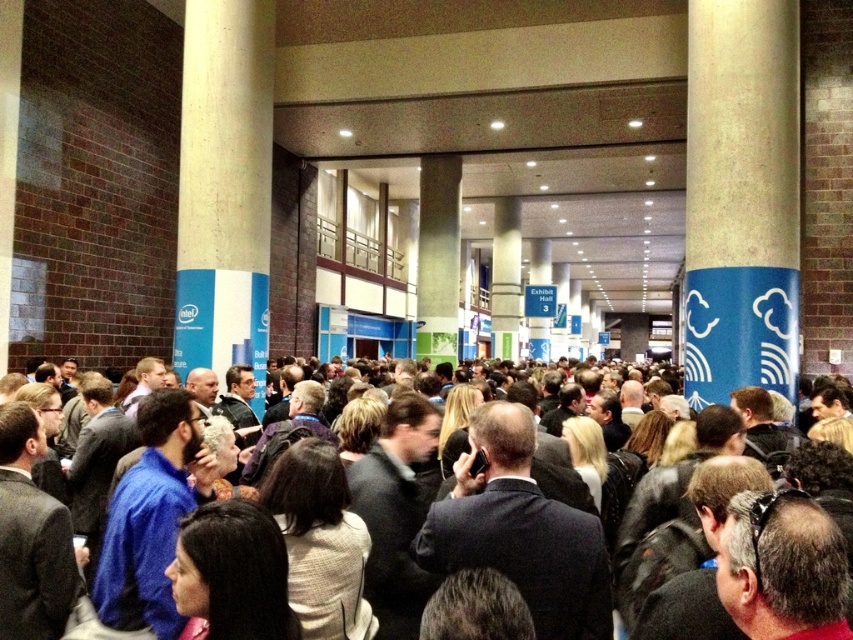
Who is lower down, blue textured pillar at right or dark suit at center?

dark suit at center is below.

In the scene shown: Which is more to the right, blue textured pillar at right or dark suit at center?

From the viewer's perspective, blue textured pillar at right appears more on the right side.

Is point (714, 342) closer to camera compared to point (821, 468)?

No, (714, 342) is behind (821, 468).

Where is `blue textured pillar at right`? The image size is (853, 640). blue textured pillar at right is located at coordinates (741, 196).

Locate an element on the screen. dark suit at center is located at coordinates (657, 531).

Which is behind, point (792, 458) or point (224, 228)?

The point (224, 228) is more distant.

Find the location of a particular element. dark suit at center is located at coordinates (657, 531).

Between blue textured pillar at right and smooth concrete pillar at left, which one is positioned lower?

smooth concrete pillar at left is lower down.

Is blue textured pillar at right wider than smooth concrete pillar at left?

No, blue textured pillar at right is not wider than smooth concrete pillar at left.

Does point (717, 88) come closer to viewer compared to point (238, 152)?

Yes, point (717, 88) is closer to viewer.

The height and width of the screenshot is (640, 853). I want to click on blue textured pillar at right, so click(x=741, y=196).